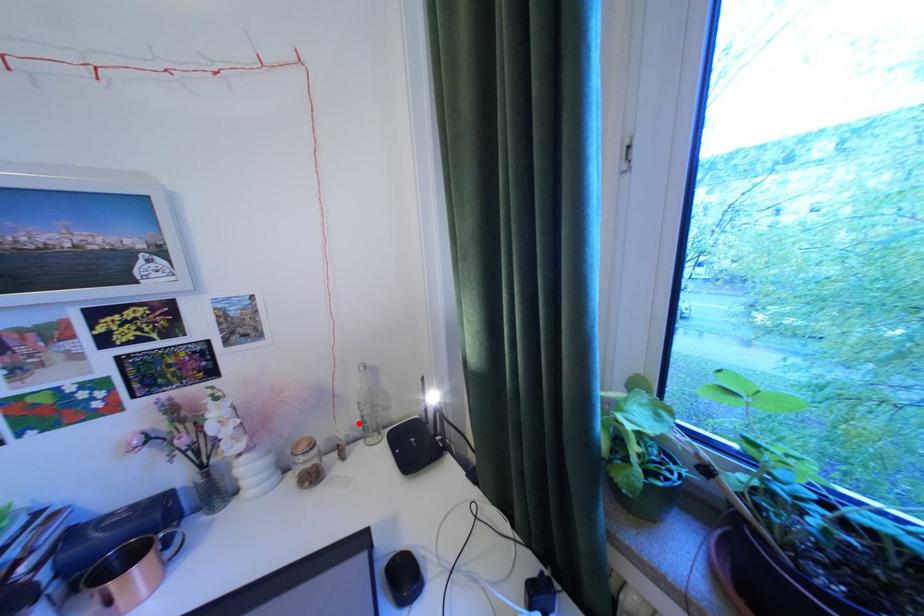
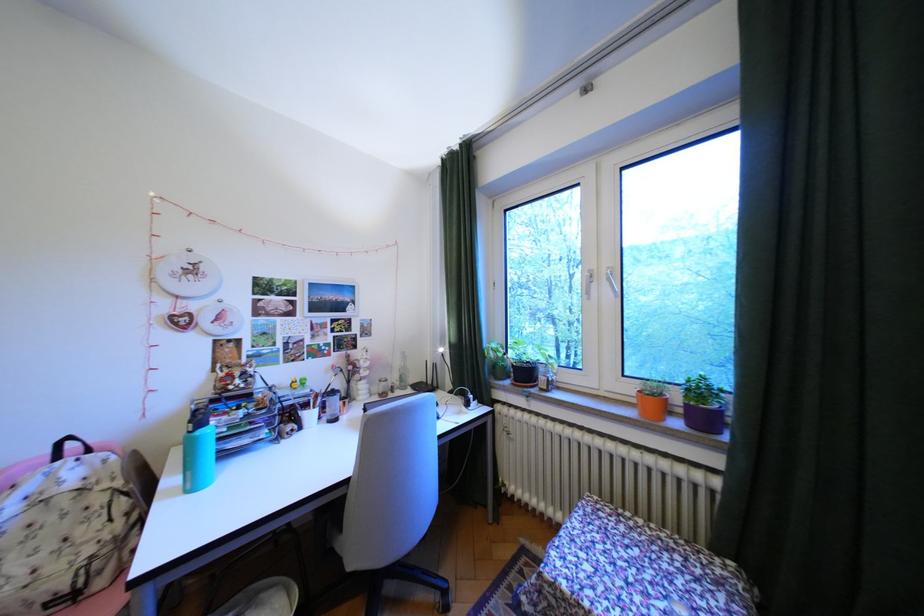
Locate, in the second image, the point that corresponds to the highlighted location in the first image.

(407, 379)